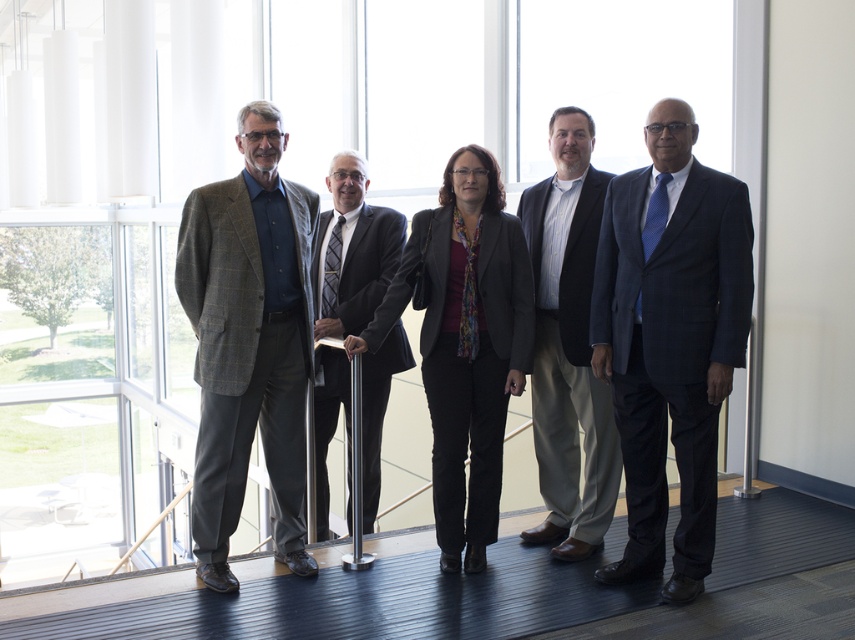
Question: Which point is farther from the camera taking this photo?

Choices:
 (A) (659, 192)
 (B) (198, 241)

Answer: (B)

Question: Which object is positioned farthest from the light brown suit at center?

Choices:
 (A) dark gray wool suit at center
 (B) matte black blazer at center
 (C) plaid wool blazer at left
 (D) matte gray suit at center

Answer: (C)

Question: Is dark blue pinstripe suit at right behind dark gray wool suit at center?

Choices:
 (A) yes
 (B) no

Answer: (B)

Question: Can you confirm if plaid wool blazer at left is positioned to the left of matte gray suit at center?

Choices:
 (A) yes
 (B) no

Answer: (A)

Question: Is plaid wool blazer at left above dark gray wool suit at center?

Choices:
 (A) yes
 (B) no

Answer: (A)

Question: Which object is positioned closest to the dark blue pinstripe suit at right?

Choices:
 (A) matte black blazer at center
 (B) light brown suit at center

Answer: (B)